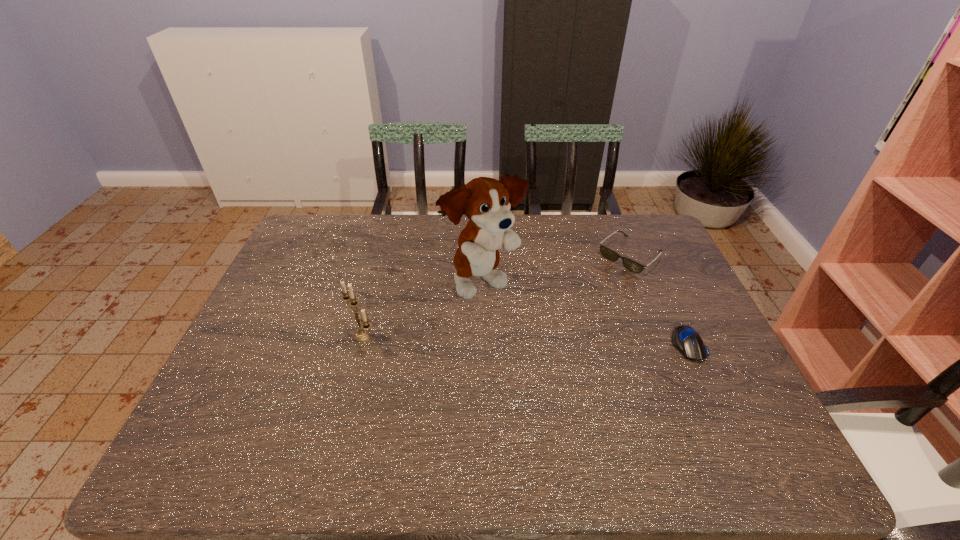
In the image, there is a desktop. Where is `vacant space at the left edge`? Image resolution: width=960 pixels, height=540 pixels. vacant space at the left edge is located at coordinates (315, 273).

Image resolution: width=960 pixels, height=540 pixels. In order to click on vacant area at the near left corner of the desktop in this screenshot , I will do `click(208, 401)`.

Locate an element on the screen. The height and width of the screenshot is (540, 960). free spot between the computer mouse and the puppy is located at coordinates 586,314.

Image resolution: width=960 pixels, height=540 pixels. Identify the location of vacant area that lies between the computer mouse and the second object from left to right. (586, 314).

The height and width of the screenshot is (540, 960). In order to click on free space between the second object from left to right and the shortest object in this screenshot , I will do pyautogui.click(x=586, y=314).

This screenshot has height=540, width=960. Find the location of `free area in between the second tallest object and the computer mouse`. free area in between the second tallest object and the computer mouse is located at coordinates (525, 340).

Locate an element on the screen. free space between the computer mouse and the third tallest object is located at coordinates (659, 300).

Find the location of `unoccupied area between the computer mouse and the sunglasses`. unoccupied area between the computer mouse and the sunglasses is located at coordinates (659, 300).

Find the location of a particular element. Image resolution: width=960 pixels, height=540 pixels. vacant space that is in between the second shortest object and the second tallest object is located at coordinates (496, 296).

You are a GUI agent. You are given a task and a screenshot of the screen. Output one action in this format:
    pyautogui.click(x=<x>, y=<y>)
    Task: Click on the free spot between the tallest object and the sunglasses
    
    Given the screenshot: What is the action you would take?
    pyautogui.click(x=557, y=269)